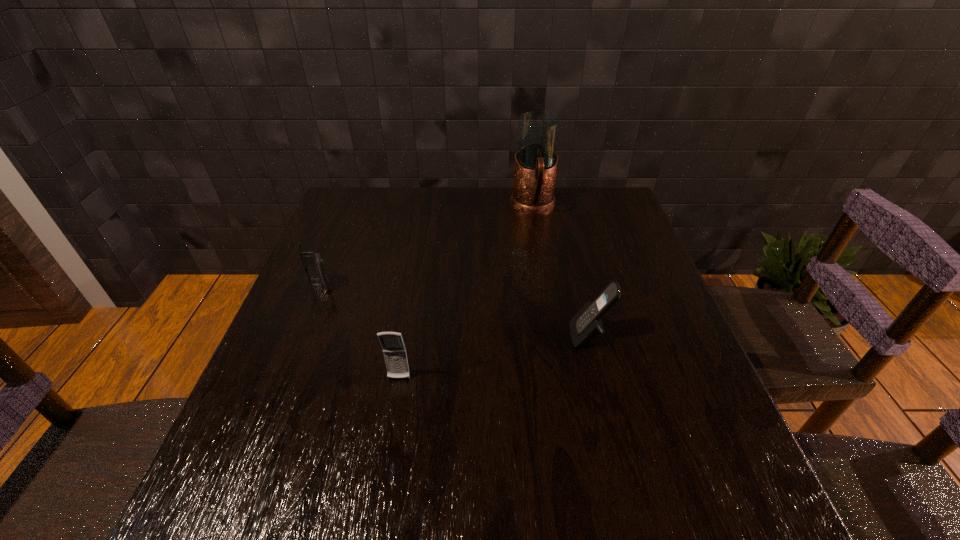
At what (x,y) coordinates should I click in order to perform the action: click on vacant area situated on the front-facing side of the rightmost cellular telephone. Please return your answer as a coordinate pair (x, y). The image size is (960, 540). Looking at the image, I should click on (446, 336).

The image size is (960, 540). Identify the location of vacant space situated 0.400m on the front-facing side of the rightmost cellular telephone. (394, 336).

This screenshot has height=540, width=960. I want to click on vacant region located 0.230m on the front-facing side of the nearest object, so click(x=379, y=500).

This screenshot has height=540, width=960. Find the location of `vacant region located 0.150m on the keyboard of the shortest cellular telephone`. vacant region located 0.150m on the keyboard of the shortest cellular telephone is located at coordinates (300, 339).

Image resolution: width=960 pixels, height=540 pixels. What are the coordinates of `object located in the far edge section of the desktop` in the screenshot? It's located at (535, 165).

Locate an element on the screen. This screenshot has width=960, height=540. object that is at the left edge is located at coordinates (313, 263).

This screenshot has height=540, width=960. I want to click on free space at the far edge, so [453, 224].

The width and height of the screenshot is (960, 540). In the image, there is a desktop. Find the location of `vacant space at the left edge`. vacant space at the left edge is located at coordinates (304, 392).

In the image, there is a desktop. Where is `vacant space at the right edge`? This screenshot has height=540, width=960. vacant space at the right edge is located at coordinates (631, 295).

Find the location of a particular element. The height and width of the screenshot is (540, 960). vacant space at the far right corner of the desktop is located at coordinates point(624,202).